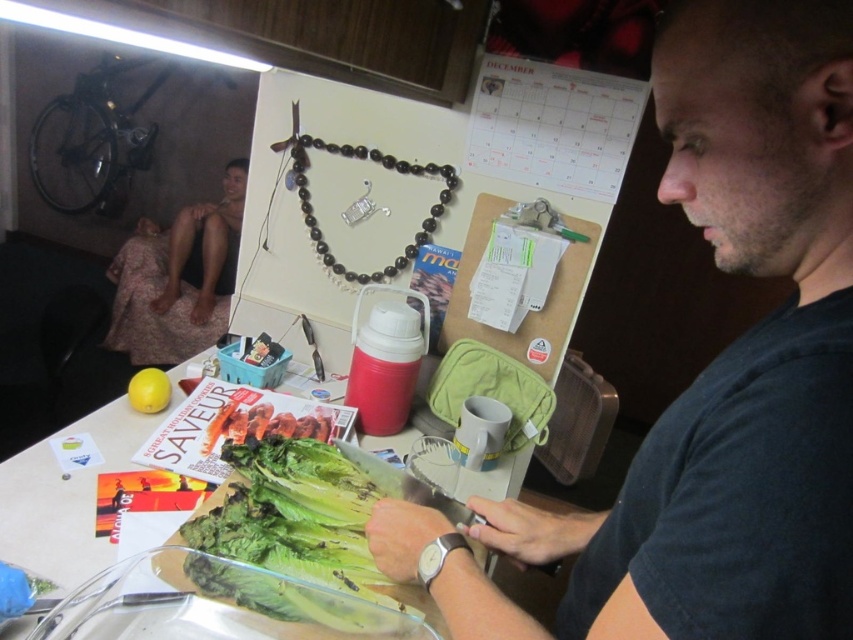
Question: Among these points, which one is farthest from the camera?

Choices:
 (A) (701, 106)
 (B) (334, 147)
 (C) (199, 525)
 (D) (3, 525)

Answer: (B)

Question: Which is nearer to the green leafy vegetable at lower center?

Choices:
 (A) green leafy lettuce at center
 (B) smooth skin man at upper left
 (C) dark gray shirt at center
 (D) dark wood beads at upper center

Answer: (A)

Question: Which of the following is the farthest from the observer?

Choices:
 (A) (291, 150)
 (B) (65, 516)
 (C) (321, 582)
 (D) (804, 314)

Answer: (A)

Question: Can you confirm if green leafy vegetable at lower center is positioned above green leafy lettuce at center?

Choices:
 (A) yes
 (B) no

Answer: (B)

Question: Considering the relative positions of green leafy vegetable at lower center and green leafy lettuce at center in the image provided, where is green leafy vegetable at lower center located with respect to green leafy lettuce at center?

Choices:
 (A) left
 (B) right

Answer: (B)

Question: Can you confirm if dark gray shirt at center is positioned to the left of dark wood beads at upper center?

Choices:
 (A) yes
 (B) no

Answer: (B)